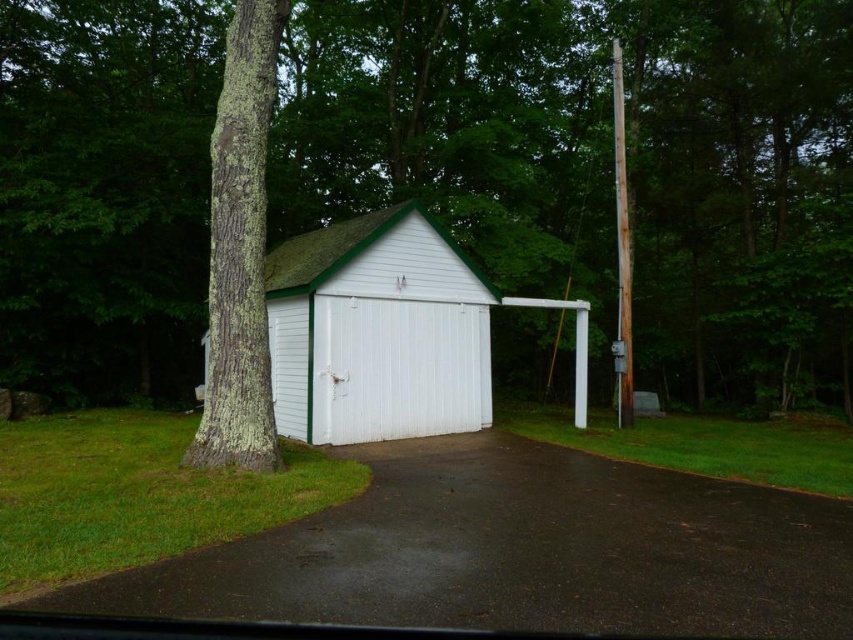
Does dark asphalt driveway at center have a lesser width compared to green lichen-covered tree trunk at left?

Yes.

In the scene shown: Does dark asphalt driveway at center lie behind green lichen-covered tree trunk at left?

Yes, it is behind green lichen-covered tree trunk at left.

Between point (221, 612) and point (241, 390), which one is positioned behind?

Point (241, 390)

Find the location of a particular element. Image resolution: width=853 pixels, height=640 pixels. dark asphalt driveway at center is located at coordinates (518, 552).

Between dark asphalt driveway at center and rusty wood pole at right, which one has less height?

Standing shorter between the two is dark asphalt driveway at center.

Consider the image. Is dark asphalt driveway at center taller than rusty wood pole at right?

No, dark asphalt driveway at center is not taller than rusty wood pole at right.

Where is `dark asphalt driveway at center`? This screenshot has height=640, width=853. dark asphalt driveway at center is located at coordinates (518, 552).

You are a GUI agent. You are given a task and a screenshot of the screen. Output one action in this format:
    pyautogui.click(x=<x>, y=<y>)
    Task: Click on the dark asphalt driveway at center
    The height and width of the screenshot is (640, 853).
    Given the screenshot: What is the action you would take?
    pyautogui.click(x=518, y=552)

Who is positioned more to the left, green rough bark tree at left or white woodshed at center?

Positioned to the left is white woodshed at center.

Who is positioned more to the right, green rough bark tree at left or white woodshed at center?

From the viewer's perspective, green rough bark tree at left appears more on the right side.

Between point (165, 4) and point (285, 314), which one is positioned in front?

Point (285, 314) is in front.

Identify the location of green rough bark tree at left. (602, 164).